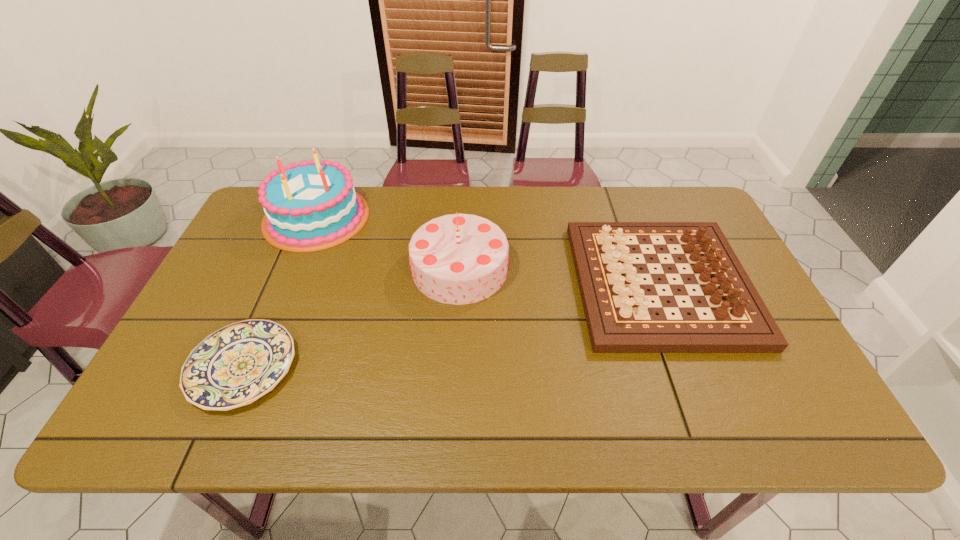
At what (x,y) coordinates should I click in order to perform the action: click on the left birthday cake. Please return your answer as a coordinate pair (x, y). Looking at the image, I should click on (309, 206).

Identify the location of the right birthday cake. (458, 259).

At what (x,y) coordinates should I click in order to perform the action: click on the third tallest object. Please return your answer as a coordinate pair (x, y). The image size is (960, 540). Looking at the image, I should click on (621, 318).

Locate an element on the screen. This screenshot has height=540, width=960. gameboard is located at coordinates (621, 318).

I want to click on plate, so click(234, 366).

Locate an element on the screen. vacant space located on the front of the left birthday cake is located at coordinates (276, 317).

Locate an element on the screen. The height and width of the screenshot is (540, 960). vacant area situated 0.320m on the right of the second object from right to left is located at coordinates (622, 268).

Identify the location of free space located on the side with the white pieces of the gameboard. This screenshot has width=960, height=540. (449, 284).

Image resolution: width=960 pixels, height=540 pixels. I want to click on free location located on the side with the white pieces of the gameboard, so click(439, 284).

The image size is (960, 540). I want to click on vacant point located on the side with the white pieces of the gameboard, so click(516, 284).